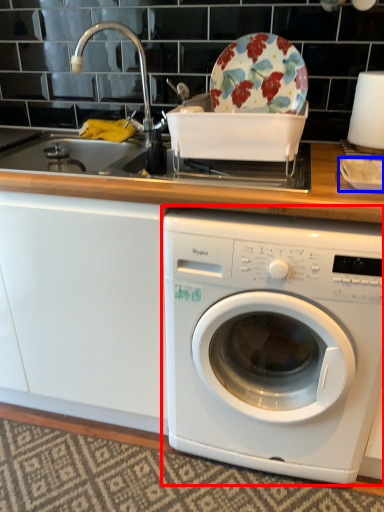
Question: Which object appears closest to the camera in this image, washing machine (highlighted by a red box) or tableware (highlighted by a blue box)?

Choices:
 (A) washing machine
 (B) tableware

Answer: (A)